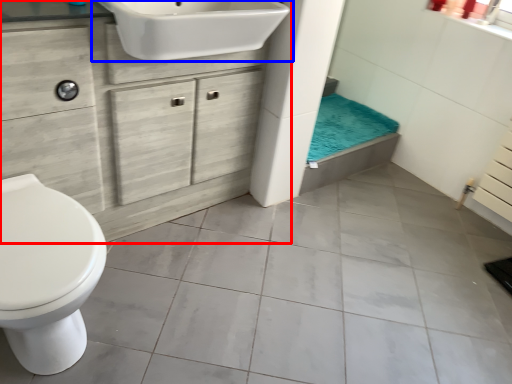
Question: Which object is closer to the camera taking this photo, bathroom cabinet (highlighted by a red box) or sink (highlighted by a blue box)?

Choices:
 (A) bathroom cabinet
 (B) sink

Answer: (A)